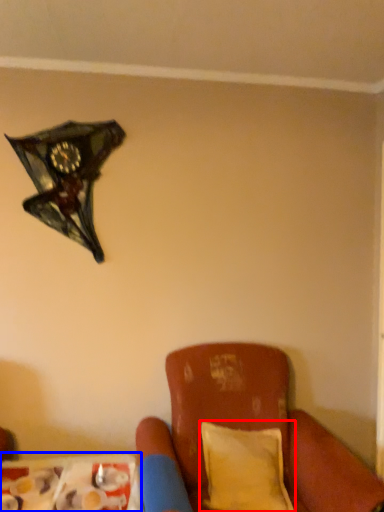
Question: Which object appears farthest to the camera in this image, pillow (highlighted by a red box) or table (highlighted by a blue box)?

Choices:
 (A) pillow
 (B) table

Answer: (A)